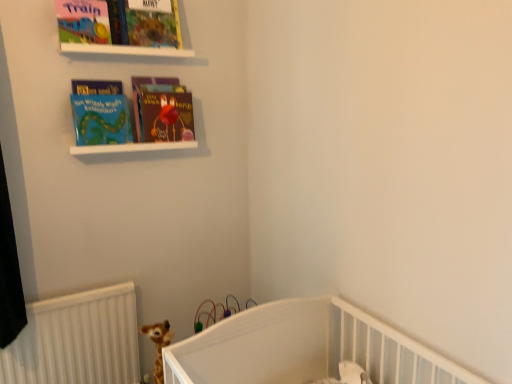
Question: Would you say matte blue book at upper left, which appears as the 2th book when viewed from the right, is outside white matte shelf at upper center?

Choices:
 (A) yes
 (B) no

Answer: (A)

Question: Is matte blue book at upper left, which appears as the first book when viewed from the left, aimed at white matte shelf at upper center?

Choices:
 (A) yes
 (B) no

Answer: (B)

Question: Is matte blue book at upper left, which appears as the first book when viewed from the left, taller than white matte shelf at upper center?

Choices:
 (A) no
 (B) yes

Answer: (B)

Question: Can you confirm if matte blue book at upper left, which appears as the 2th book when viewed from the right, is smaller than white matte shelf at upper center?

Choices:
 (A) no
 (B) yes

Answer: (A)

Question: Does matte blue book at upper left, which appears as the 2th book when viewed from the right, have a lesser height compared to white matte shelf at upper center?

Choices:
 (A) yes
 (B) no

Answer: (B)

Question: From a real-world perspective, relative to matte hardcover book at center, which is the second book in left-to-right order, is matte colorful book at upper center, which is counted as the 1th book cover, starting from the right, vertically above or below?

Choices:
 (A) below
 (B) above

Answer: (B)

Question: Visually, is matte colorful book at upper center, marked as the second book cover in a left-to-right arrangement, positioned to the left or to the right of matte hardcover book at center, acting as the first book starting from the right?

Choices:
 (A) left
 (B) right

Answer: (A)

Question: From the image's perspective, is matte colorful book at upper center, which is counted as the 1th book cover, starting from the right, positioned above or below matte hardcover book at center, which is the second book in left-to-right order?

Choices:
 (A) above
 (B) below

Answer: (A)

Question: Do you think matte colorful book at upper center, marked as the second book cover in a left-to-right arrangement, is within matte hardcover book at center, which is the second book in left-to-right order, or outside of it?

Choices:
 (A) outside
 (B) inside

Answer: (A)

Question: Is matte board book at upper left, the 2th book cover in the right-to-left sequence, situated inside white matte shelf at upper center or outside?

Choices:
 (A) outside
 (B) inside

Answer: (A)

Question: From the image's perspective, is matte board book at upper left, the 2th book cover in the right-to-left sequence, above or below white matte shelf at upper center?

Choices:
 (A) below
 (B) above

Answer: (B)

Question: Is matte board book at upper left, marked as the 1th book cover in a left-to-right arrangement, taller or shorter than white matte shelf at upper center?

Choices:
 (A) tall
 (B) short

Answer: (A)

Question: Considering the positions of point (80, 39) and point (106, 147), is point (80, 39) closer or farther from the camera than point (106, 147)?

Choices:
 (A) closer
 (B) farther

Answer: (A)

Question: Is white matte shelf at upper center wider or thinner than matte hardcover book at center, acting as the first book starting from the right?

Choices:
 (A) thin
 (B) wide

Answer: (B)

Question: From a real-world perspective, is white matte shelf at upper center physically located above or below matte hardcover book at center, acting as the first book starting from the right?

Choices:
 (A) below
 (B) above

Answer: (A)